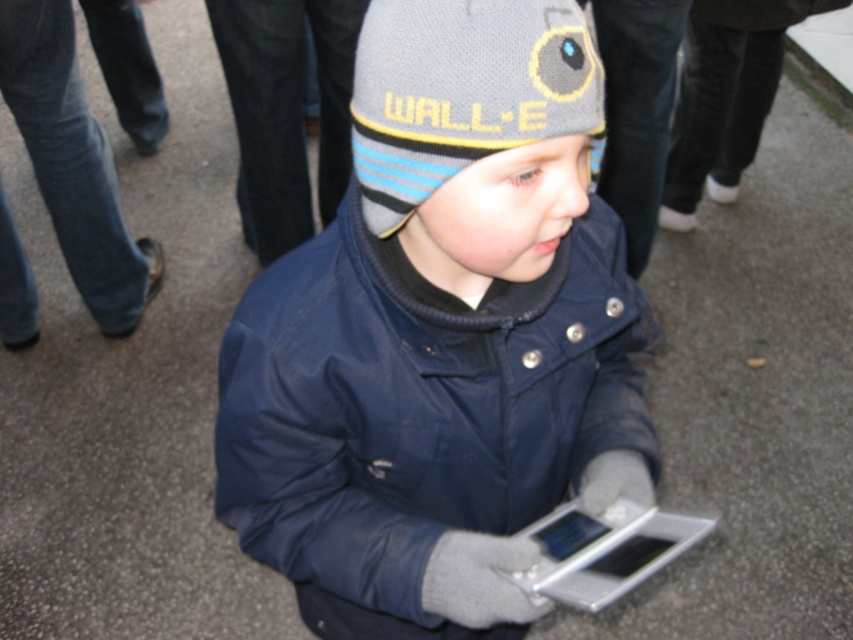
Does matte blue jacket at center appear on the right side of gray knitted hat at center?

Indeed, matte blue jacket at center is positioned on the right side of gray knitted hat at center.

Is matte blue jacket at center below gray knitted hat at center?

Indeed, matte blue jacket at center is positioned under gray knitted hat at center.

Which is in front, point (608, 280) or point (402, 150)?

Point (402, 150)

Find the location of a particular element. matte blue jacket at center is located at coordinates 440,336.